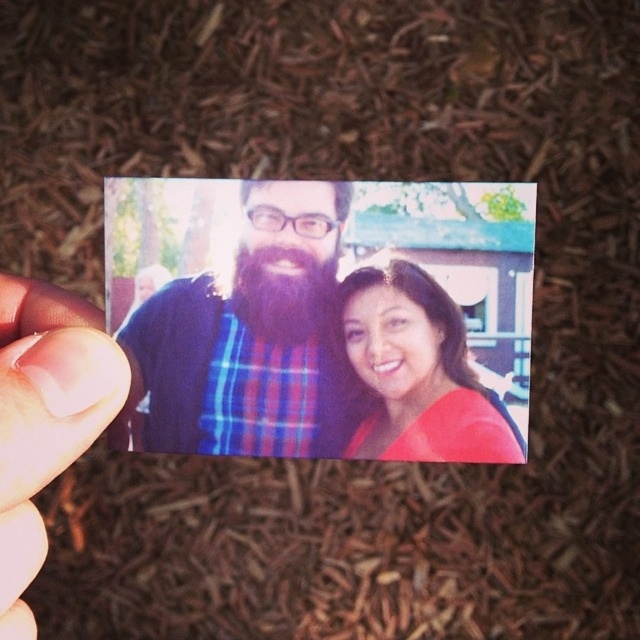
Measure the distance between plaid fabric shirt at center and camera.

plaid fabric shirt at center and camera are 15.03 inches apart from each other.

Who is positioned more to the left, plaid fabric shirt at center or pale skin at center?

From the viewer's perspective, pale skin at center appears more on the left side.

I want to click on plaid fabric shirt at center, so click(x=248, y=337).

Does point (189, 422) lie in front of point (388, 320)?

No, it is not.

At what (x,y) coordinates should I click in order to perform the action: click on plaid fabric shirt at center. Please return your answer as a coordinate pair (x, y). The image size is (640, 640). Looking at the image, I should click on click(x=248, y=337).

Identify the location of plaid fabric shirt at center. This screenshot has width=640, height=640. (248, 337).

Who is more distant from viewer, (4, 436) or (346, 310)?

The point (346, 310) is more distant.

Find the location of a particular element. The width and height of the screenshot is (640, 640). pale skin at center is located at coordinates (44, 419).